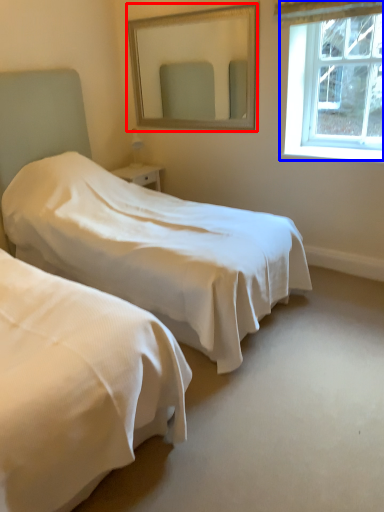
Question: Which of the following is the farthest to the observer, mirror (highlighted by a red box) or window (highlighted by a blue box)?

Choices:
 (A) mirror
 (B) window

Answer: (A)